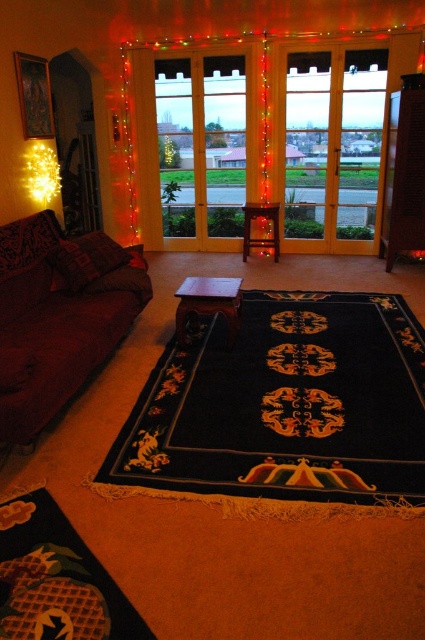
Based on the photo, is velvet dark red couch at left above clear glass window at center?

No, velvet dark red couch at left is not above clear glass window at center.

Who is more distant from viewer, (91, 321) or (206, 160)?

Positioned behind is point (206, 160).

Locate an element on the screen. velvet dark red couch at left is located at coordinates (57, 316).

Who is more forward, (47, 378) or (28, 177)?

Point (47, 378) is more forward.

Does point (33, 237) lie behind point (51, 189)?

No.

Is point (30, 355) positioned behind point (59, 166)?

No.

Where is `velvet dark red couch at left`? Image resolution: width=425 pixels, height=640 pixels. velvet dark red couch at left is located at coordinates (57, 316).

Is velvet dark red couch at left bigger than transparent glass door at center?

Yes.

Is velvet dark red couch at left wider than transparent glass door at center?

No, velvet dark red couch at left is not wider than transparent glass door at center.

Image resolution: width=425 pixels, height=640 pixels. I want to click on velvet dark red couch at left, so click(x=57, y=316).